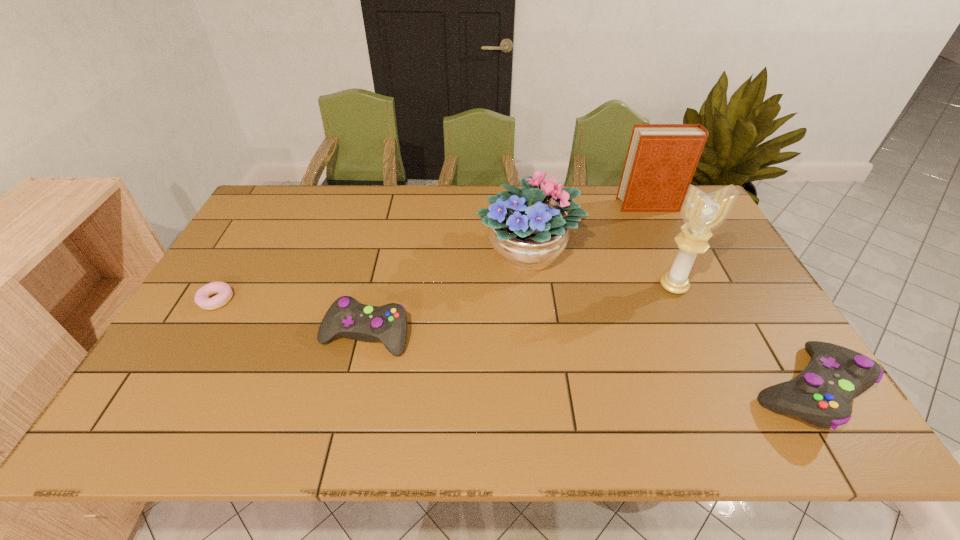
The image size is (960, 540). What are the coordinates of `object that is at the left edge` in the screenshot? It's located at (223, 290).

I want to click on control at the right edge, so click(821, 395).

You are a GUI agent. You are given a task and a screenshot of the screen. Output one action in this format:
    pyautogui.click(x=<x>, y=<y>)
    Task: Click on the hardback book that is at the right edge
    
    Given the screenshot: What is the action you would take?
    pyautogui.click(x=661, y=160)

The height and width of the screenshot is (540, 960). What are the coordinates of `object situated at the far right corner` in the screenshot? It's located at (661, 160).

I want to click on object at the near right corner, so click(x=821, y=395).

The height and width of the screenshot is (540, 960). In order to click on free space at the far edge of the desktop in this screenshot , I will do `click(388, 211)`.

Where is `free space at the near edge`? free space at the near edge is located at coordinates (596, 387).

In the image, there is a desktop. Find the location of `vacant space at the left edge`. vacant space at the left edge is located at coordinates (182, 354).

The width and height of the screenshot is (960, 540). Find the location of `free space at the right edge of the desktop`. free space at the right edge of the desktop is located at coordinates (698, 275).

Identify the location of free area in between the award and the third shortest object. (740, 338).